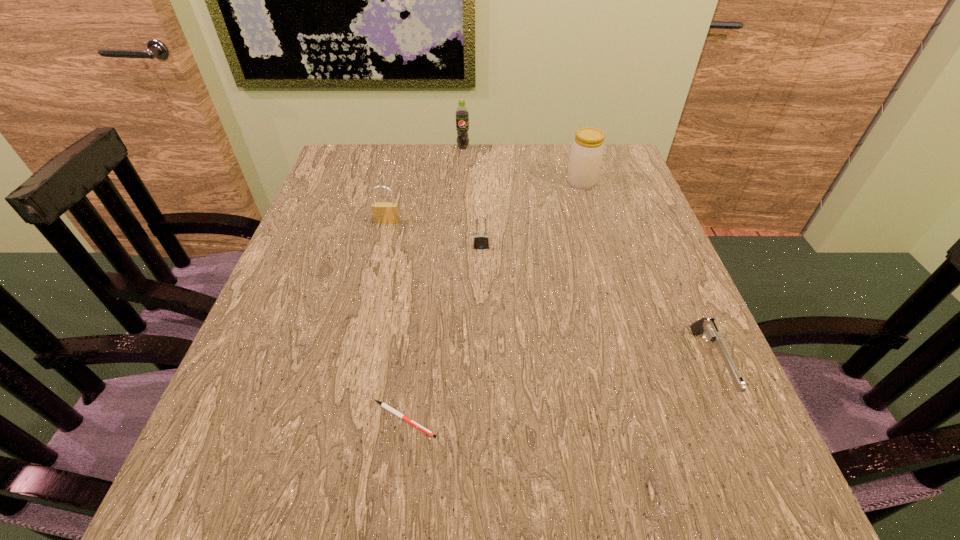
Where is `free spot that satisfies the following two spatial constraints: 1. on the shackle of the third nearest object; 2. on the clicker of the shortest object`? free spot that satisfies the following two spatial constraints: 1. on the shackle of the third nearest object; 2. on the clicker of the shortest object is located at coordinates (482, 419).

Locate an element on the screen. Image resolution: width=960 pixels, height=540 pixels. free location that satisfies the following two spatial constraints: 1. on the front label of the soda; 2. on the clicker of the pen is located at coordinates (448, 419).

Find the location of `free spot that satisfies the following two spatial constraints: 1. on the front-facing side of the fifth tallest object; 2. on the clicker of the pen`. free spot that satisfies the following two spatial constraints: 1. on the front-facing side of the fifth tallest object; 2. on the clicker of the pen is located at coordinates (732, 419).